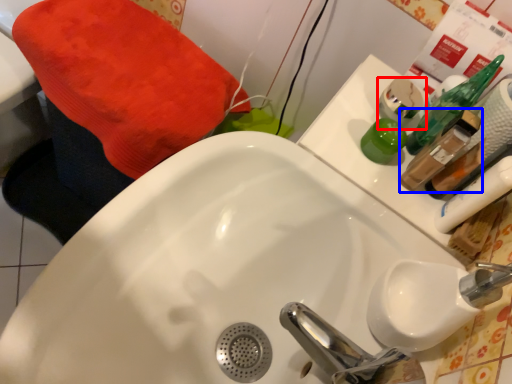
Question: Which object is closer to the camera taking this photo, mouthwash (highlighted by a red box) or mouthwash (highlighted by a blue box)?

Choices:
 (A) mouthwash
 (B) mouthwash

Answer: (B)